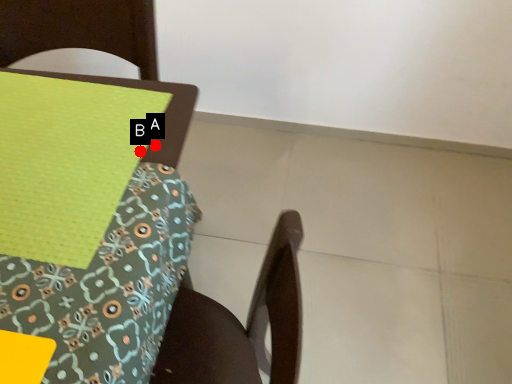
Question: Two points are circled on the image, labeled by A and B beside each circle. Which point is closer to the camera taking this photo?

Choices:
 (A) A is closer
 (B) B is closer

Answer: (B)